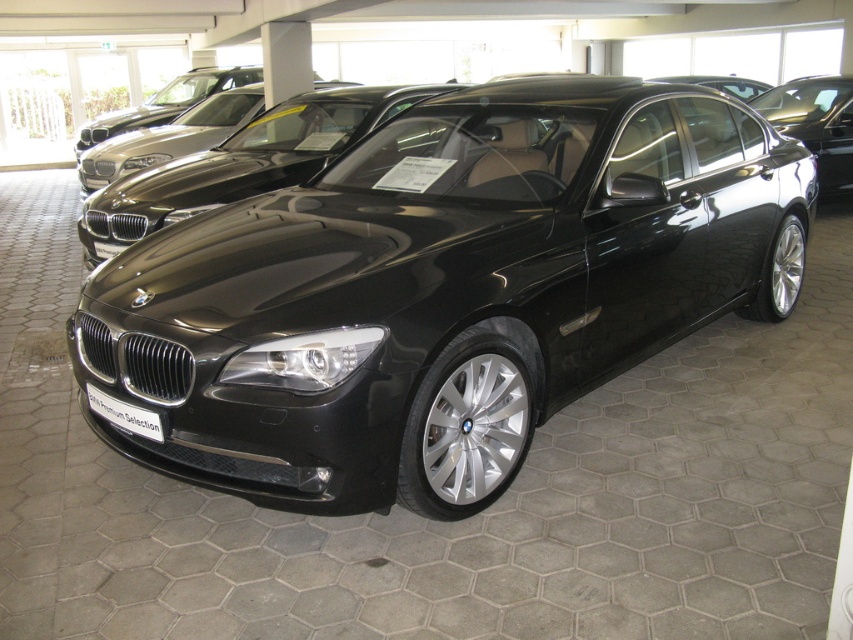
Question: Which object is farther from the camera taking this photo?

Choices:
 (A) black metallic license plate at center
 (B) shiny black car at center
 (C) satin black sedan at center

Answer: (C)

Question: Does shiny black car at center have a smaller size compared to black metallic license plate at center?

Choices:
 (A) no
 (B) yes

Answer: (A)

Question: Is the position of shiny black car at center more distant than that of black metallic license plate at center?

Choices:
 (A) no
 (B) yes

Answer: (A)

Question: Observing the image, what is the correct spatial positioning of satin black sedan at center in reference to black metallic license plate at center?

Choices:
 (A) below
 (B) above

Answer: (B)

Question: Which point is closer to the camera?

Choices:
 (A) shiny black car at center
 (B) black metallic license plate at center

Answer: (A)

Question: Which object is farther from the camera taking this photo?

Choices:
 (A) black metallic license plate at center
 (B) satin black sedan at center
 (C) shiny black car at center

Answer: (B)